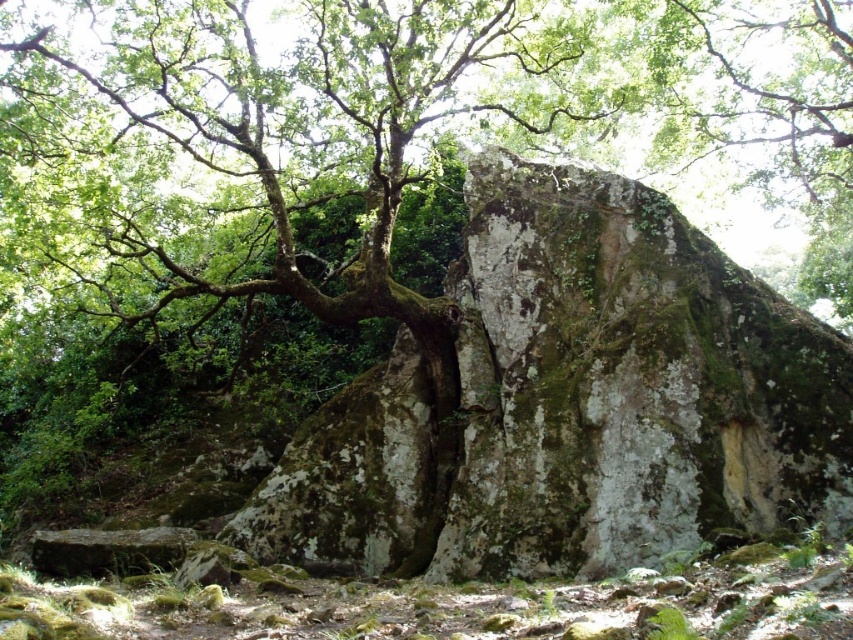
Question: Does green mossy tree at center have a greater width compared to green mossy rock at center?

Choices:
 (A) yes
 (B) no

Answer: (A)

Question: Is green mossy tree at center above green mossy rock at center?

Choices:
 (A) yes
 (B) no

Answer: (A)

Question: Observing the image, what is the correct spatial positioning of green mossy tree at center in reference to green mossy rock at center?

Choices:
 (A) left
 (B) right

Answer: (A)

Question: Which point appears farthest from the camera in this image?

Choices:
 (A) (294, 520)
 (B) (834, 138)

Answer: (B)

Question: Which of the following is the closest to the observer?

Choices:
 (A) (703, 337)
 (B) (137, 161)

Answer: (A)